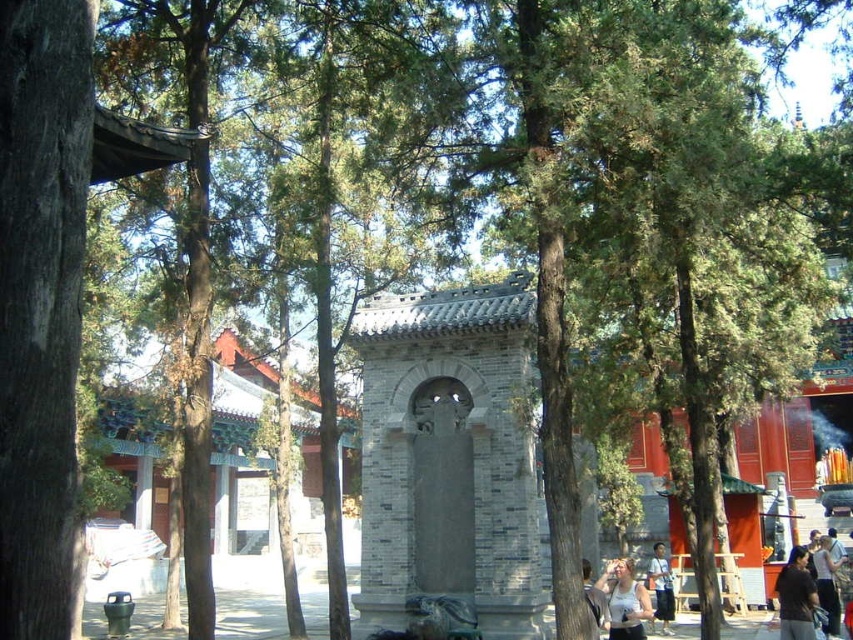
How much distance is there between smooth brown bark at left and light blue shirt at center?

smooth brown bark at left is 51.61 meters away from light blue shirt at center.

Is point (33, 225) farther from viewer compared to point (666, 564)?

That is False.

This screenshot has width=853, height=640. I want to click on smooth brown bark at left, so click(x=39, y=301).

In the scene shown: Can you confirm if smooth brown bark at left is thinner than dark brown hair at lower right?

Yes, smooth brown bark at left is thinner than dark brown hair at lower right.

Is smooth brown bark at left taller than dark brown hair at lower right?

Yes.

The height and width of the screenshot is (640, 853). Identify the location of smooth brown bark at left. (39, 301).

Locate an element on the screen. Image resolution: width=853 pixels, height=640 pixels. smooth brown bark at left is located at coordinates coord(39,301).

Does white fabric tank top at lower center appear on the left side of light blue shirt at center?

Yes, white fabric tank top at lower center is to the left of light blue shirt at center.

Identify the location of white fabric tank top at lower center. (624, 600).